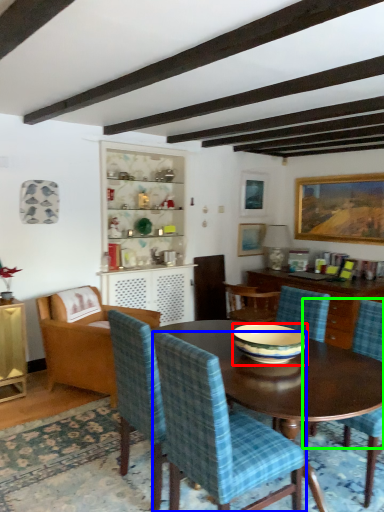
Question: Considering the real-world distances, which object is closest to bowl (highlighted by a red box)? chair (highlighted by a blue box) or chair (highlighted by a green box).

Choices:
 (A) chair
 (B) chair

Answer: (A)